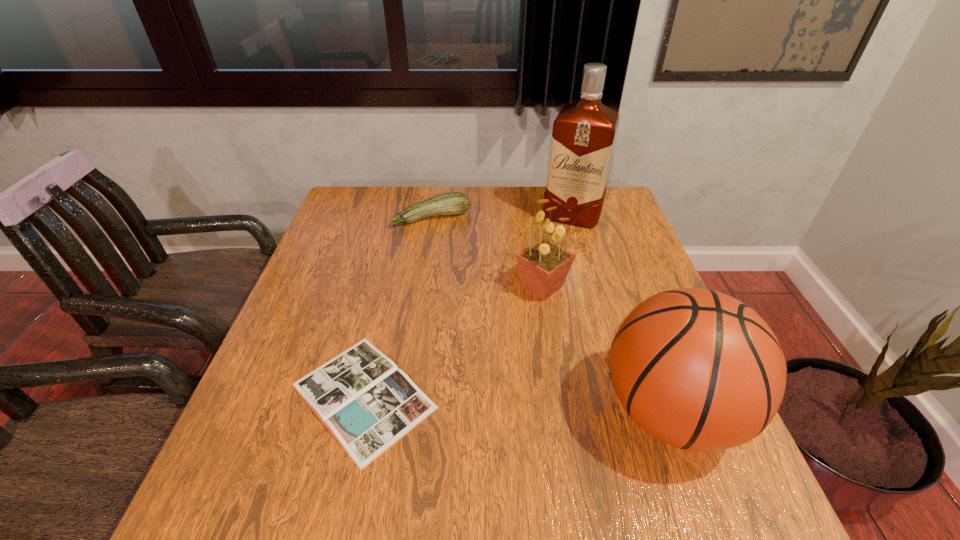
Identify the location of free space located on the front label of the tallest object. (559, 244).

Where is `free space located 0.110m on the front label of the tallest object`? The width and height of the screenshot is (960, 540). free space located 0.110m on the front label of the tallest object is located at coordinates (556, 252).

Identify the location of vacant region located 0.190m on the front label of the tallest object. Image resolution: width=960 pixels, height=540 pixels. (549, 269).

Where is `vacant area situated at the front of the sunflower with flowers visible`? The width and height of the screenshot is (960, 540). vacant area situated at the front of the sunflower with flowers visible is located at coordinates (564, 437).

Where is `vacant space located 0.150m at the front of the sunflower with flowers visible`? This screenshot has height=540, width=960. vacant space located 0.150m at the front of the sunflower with flowers visible is located at coordinates (552, 356).

In order to click on blank area located 0.360m at the front of the sunflower with flowers visible in this screenshot , I will do `click(565, 447)`.

Find the location of a particular element. The height and width of the screenshot is (540, 960). zucchini positioned at the far edge is located at coordinates (453, 203).

Locate an element on the screen. liquor positioned at the far edge is located at coordinates (583, 137).

The height and width of the screenshot is (540, 960). What are the coordinates of `book at the near edge` in the screenshot? It's located at (367, 403).

Locate an element on the screen. This screenshot has width=960, height=540. basketball that is positioned at the near edge is located at coordinates (697, 369).